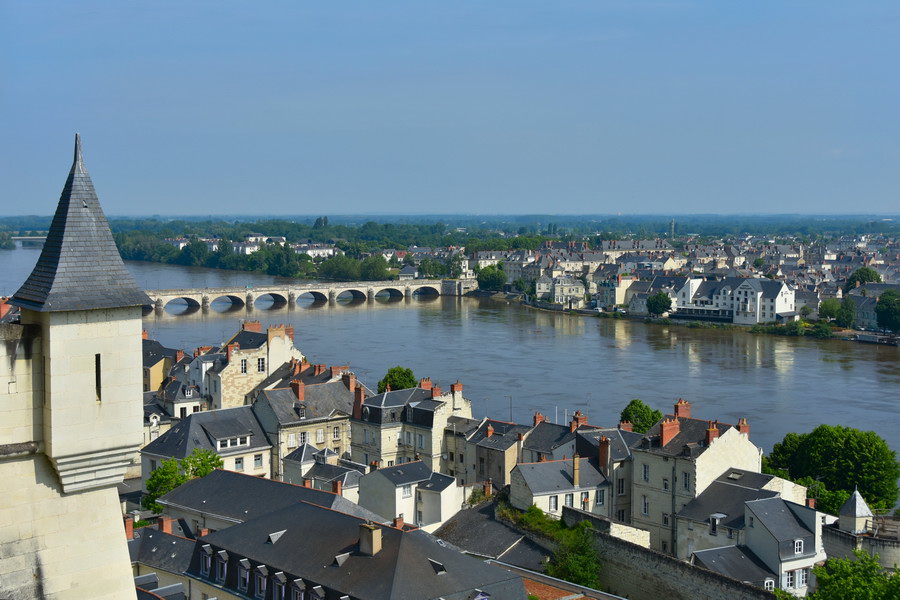
Where is `windows on houses, left of center`? Image resolution: width=900 pixels, height=600 pixels. windows on houses, left of center is located at coordinates (265, 462), (226, 458), (230, 370), (262, 369), (245, 360).